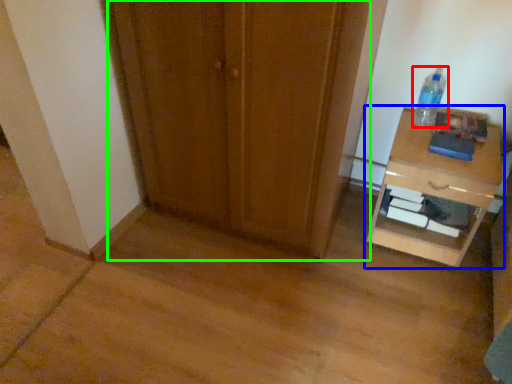
Question: Which object is the farthest from bottle (highlighted by a red box)? Choose among these: nightstand (highlighted by a blue box) or door (highlighted by a green box).

Choices:
 (A) nightstand
 (B) door

Answer: (B)